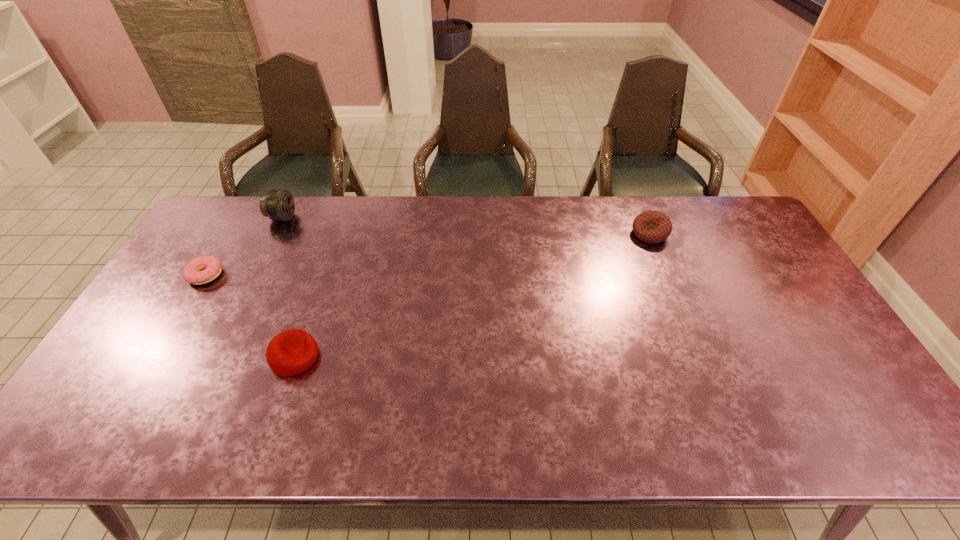
Image resolution: width=960 pixels, height=540 pixels. In order to click on vacant region between the third farthest object and the third object from left to right in this screenshot , I will do `click(250, 316)`.

This screenshot has width=960, height=540. What are the coordinates of `free spot between the shortest object and the farther beanbag` in the screenshot? It's located at (427, 254).

In order to click on vacant area that lies between the left beanbag and the telephoto lens in this screenshot , I will do `click(289, 287)`.

Locate an element on the screen. vacant space that's between the right beanbag and the second object from left to right is located at coordinates [467, 226].

Image resolution: width=960 pixels, height=540 pixels. In order to click on unoccupied position between the third farthest object and the third object from right to left in this screenshot , I will do `click(244, 246)`.

Find the location of `free space between the nearer beanbag and the right beanbag`. free space between the nearer beanbag and the right beanbag is located at coordinates (472, 295).

Where is `free space that is in between the right beanbag and the doughnut`? free space that is in between the right beanbag and the doughnut is located at coordinates (427, 254).

Identify the location of empty space between the telephoto lens and the farther beanbag. The width and height of the screenshot is (960, 540). (467, 226).

Where is `vacant space in between the nearest object and the rightmost object`? The height and width of the screenshot is (540, 960). vacant space in between the nearest object and the rightmost object is located at coordinates (472, 295).

Find the location of a particular element. empty location between the right beanbag and the telephoto lens is located at coordinates click(x=467, y=226).